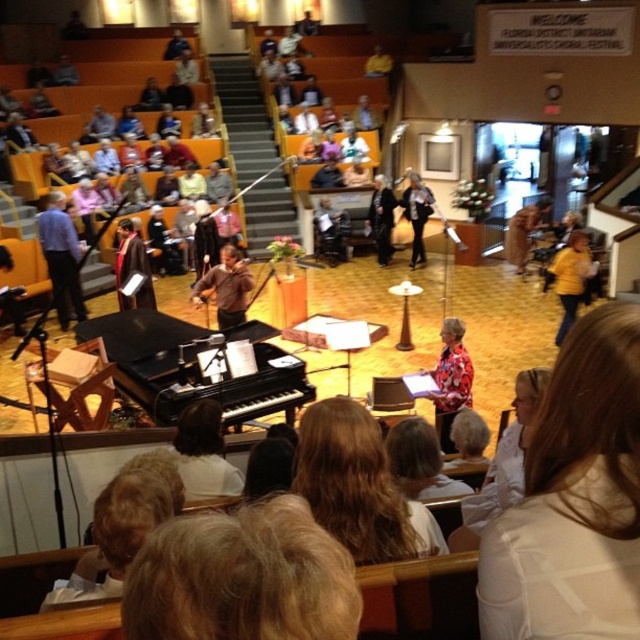
Does black polished piano at center have a greater height compared to blonde hair at center?

Yes.

Consider the image. Who is higher up, black polished piano at center or blonde hair at center?

Positioned higher is black polished piano at center.

I want to click on black polished piano at center, so click(195, 368).

Is point (538, 557) closer to viewer compared to point (129, 326)?

Yes, point (538, 557) is closer to viewer.

Does white fabric shirt at lower right appear on the right side of black polished piano at center?

Correct, you'll find white fabric shirt at lower right to the right of black polished piano at center.

Does point (588, 460) lie behind point (227, 408)?

That is False.

At what (x,y) coordinates should I click in order to perform the action: click on white fabric shirt at lower right. Please return your answer as a coordinate pair (x, y). The width and height of the screenshot is (640, 640). Looking at the image, I should click on (573, 499).

The image size is (640, 640). In order to click on white fabric shirt at lower right in this screenshot , I will do `click(573, 499)`.

Is white fabric shirt at lower right above matte blue shirt at left?

No.

Is point (609, 458) behind point (42, 237)?

That is False.

Identify the location of white fabric shirt at lower right. [x=573, y=499].